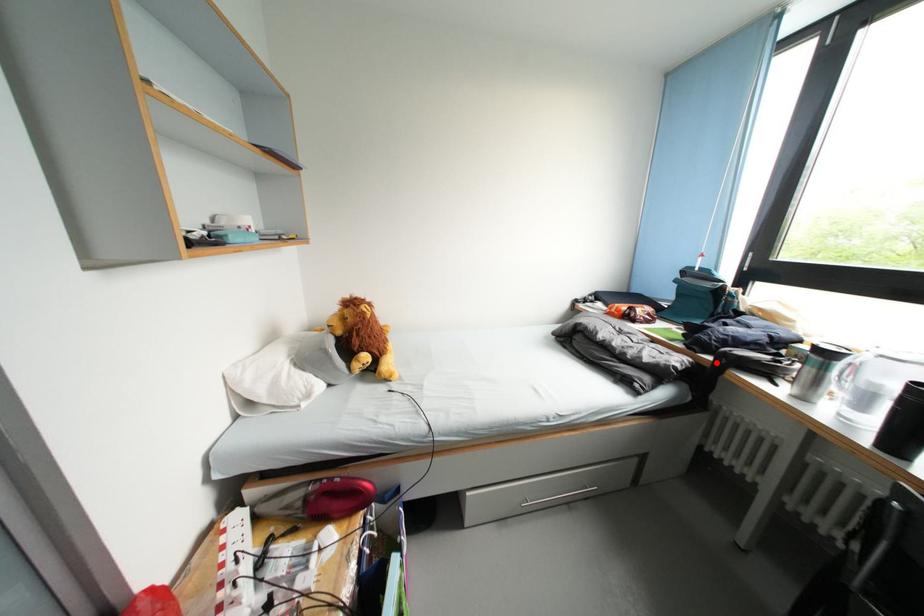
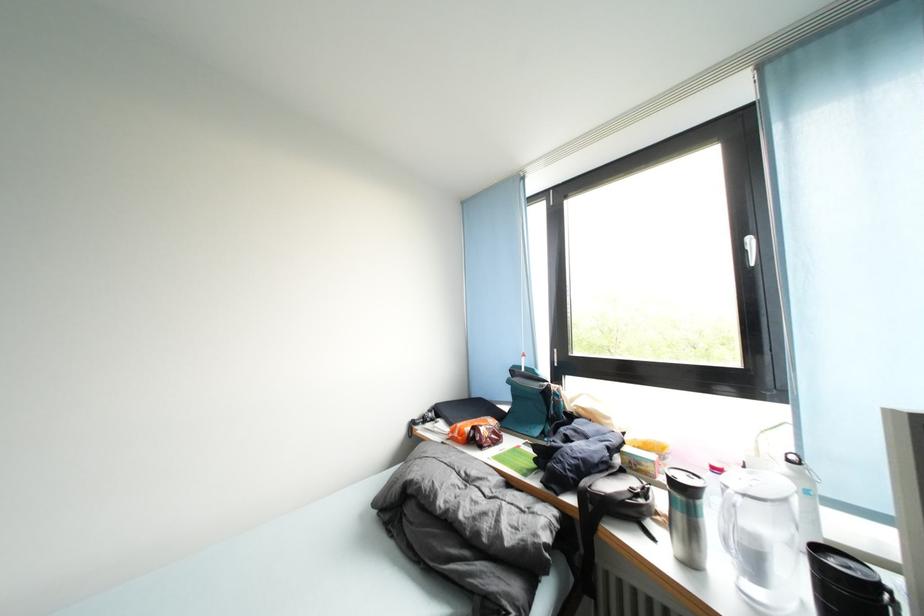
Locate, in the second image, the point that corresponds to the highlighted location in the first image.

(579, 505)